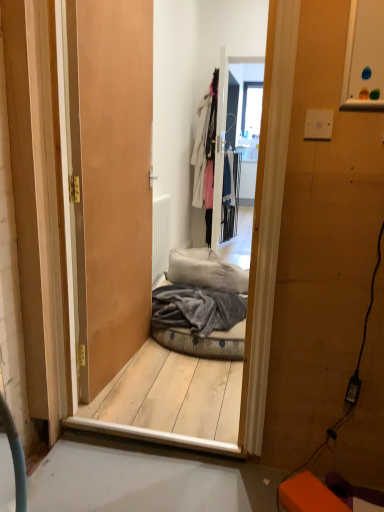
Question: Can you confirm if white cotton coat at upper center is positioned to the right of transparent glass window at upper center?

Choices:
 (A) no
 (B) yes

Answer: (A)

Question: From the image's perspective, is white cotton coat at upper center under transparent glass window at upper center?

Choices:
 (A) no
 (B) yes

Answer: (B)

Question: Is white cotton coat at upper center positioned far away from transparent glass window at upper center?

Choices:
 (A) no
 (B) yes

Answer: (A)

Question: From a real-world perspective, is white cotton coat at upper center located higher than transparent glass window at upper center?

Choices:
 (A) yes
 (B) no

Answer: (B)

Question: From the image's perspective, does white cotton coat at upper center appear higher than transparent glass window at upper center?

Choices:
 (A) no
 (B) yes

Answer: (A)

Question: Looking at their shapes, would you say velvet grey pet bed at center is wider or thinner than gray fleece blanket at center?

Choices:
 (A) thin
 (B) wide

Answer: (B)

Question: From the image's perspective, relative to gray fleece blanket at center, is velvet grey pet bed at center above or below?

Choices:
 (A) above
 (B) below

Answer: (B)

Question: Is velvet grey pet bed at center in front of or behind gray fleece blanket at center in the image?

Choices:
 (A) behind
 (B) front

Answer: (A)

Question: Do you think velvet grey pet bed at center is within gray fleece blanket at center, or outside of it?

Choices:
 (A) inside
 (B) outside

Answer: (A)

Question: Is point (139, 292) positioned closer to the camera than point (157, 230)?

Choices:
 (A) farther
 (B) closer

Answer: (B)

Question: Is wooden door at center situated inside white matte radiator at center or outside?

Choices:
 (A) inside
 (B) outside

Answer: (B)

Question: From the image's perspective, is wooden door at center above or below white matte radiator at center?

Choices:
 (A) below
 (B) above

Answer: (B)

Question: Is wooden door at center to the left or to the right of white matte radiator at center in the image?

Choices:
 (A) left
 (B) right

Answer: (A)

Question: Would you say white matte radiator at center is inside or outside white cotton coat at upper center?

Choices:
 (A) inside
 (B) outside

Answer: (B)

Question: Considering the positions of white matte radiator at center and white cotton coat at upper center in the image, is white matte radiator at center wider or thinner than white cotton coat at upper center?

Choices:
 (A) wide
 (B) thin

Answer: (B)